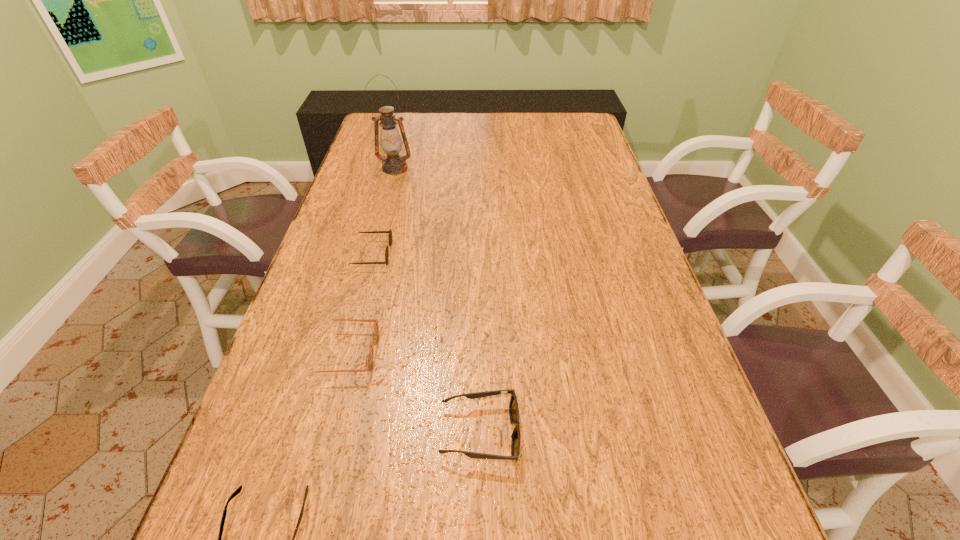
This screenshot has height=540, width=960. I want to click on the tallest object, so click(x=391, y=143).

At what (x,y) coordinates should I click in order to perform the action: click on the farthest object. Please return your answer as a coordinate pair (x, y). Looking at the image, I should click on (391, 143).

Locate an element on the screen. the fourth nearest object is located at coordinates (390, 232).

Locate an element on the screen. This screenshot has height=540, width=960. the third nearest object is located at coordinates (375, 331).

Identify the location of the rightmost object. Image resolution: width=960 pixels, height=540 pixels. (513, 405).

At what (x,y) coordinates should I click in order to perform the action: click on the third farthest sunglasses. Please return your answer as a coordinate pair (x, y). Image resolution: width=960 pixels, height=540 pixels. Looking at the image, I should click on (513, 405).

What are the coordinates of `vacant area located on the front of the tallest object` in the screenshot? It's located at (390, 188).

The width and height of the screenshot is (960, 540). I want to click on vacant space located on the front-facing side of the farthest sunglasses, so click(x=473, y=254).

Where is `free space located 0.360m on the front-facing side of the third nearest object`? free space located 0.360m on the front-facing side of the third nearest object is located at coordinates (544, 353).

Identify the location of free spot located on the front-facing side of the third farthest sunglasses. (660, 432).